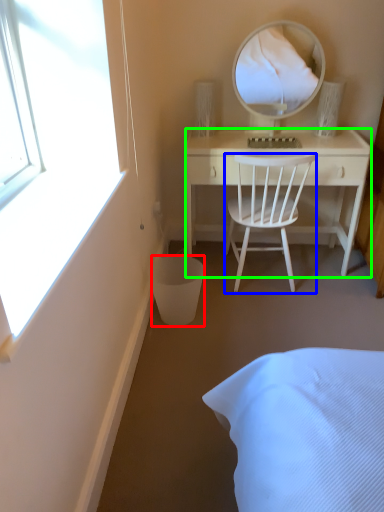
Question: Estimate the real-world distances between objects in this image. Which object is closer to trash bin/can (highlighted by a red box), chair (highlighted by a blue box) or desk (highlighted by a green box)?

Choices:
 (A) chair
 (B) desk

Answer: (A)